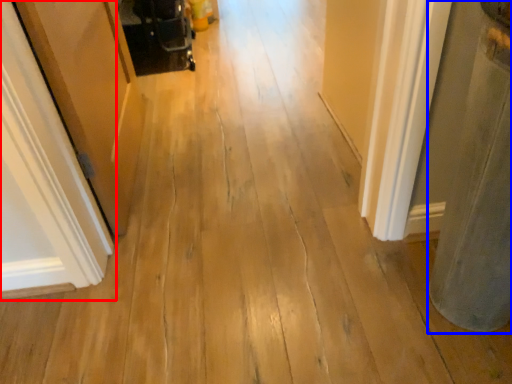
Question: Among these objects, which one is nearest to the camera, door (highlighted by a red box) or pillar (highlighted by a blue box)?

Choices:
 (A) door
 (B) pillar

Answer: (B)